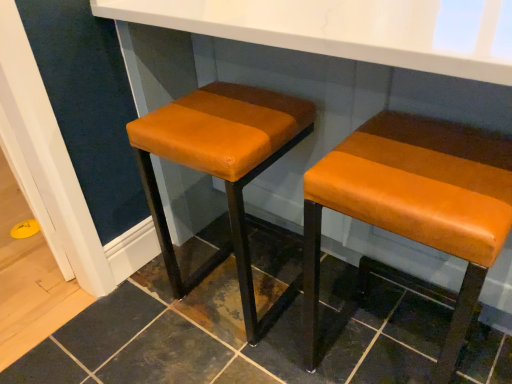
Locate an element on the screen. The height and width of the screenshot is (384, 512). empty space that is in between orange leather stool at center, the 2th stool from the right, and orange leather stool at right, the 1th stool in the right-to-left sequence is located at coordinates (298, 323).